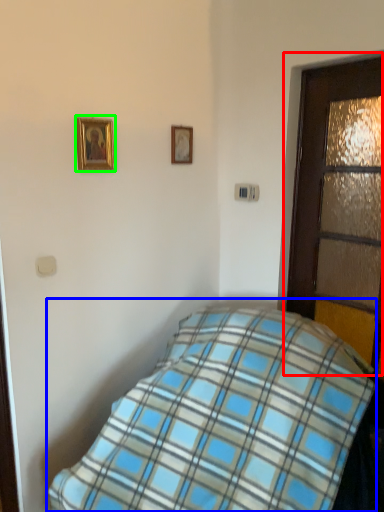
Question: Estimate the real-world distances between objects in this image. Which object is closer to door (highlighted by a red box), bed (highlighted by a blue box) or picture frame (highlighted by a green box)?

Choices:
 (A) bed
 (B) picture frame

Answer: (A)